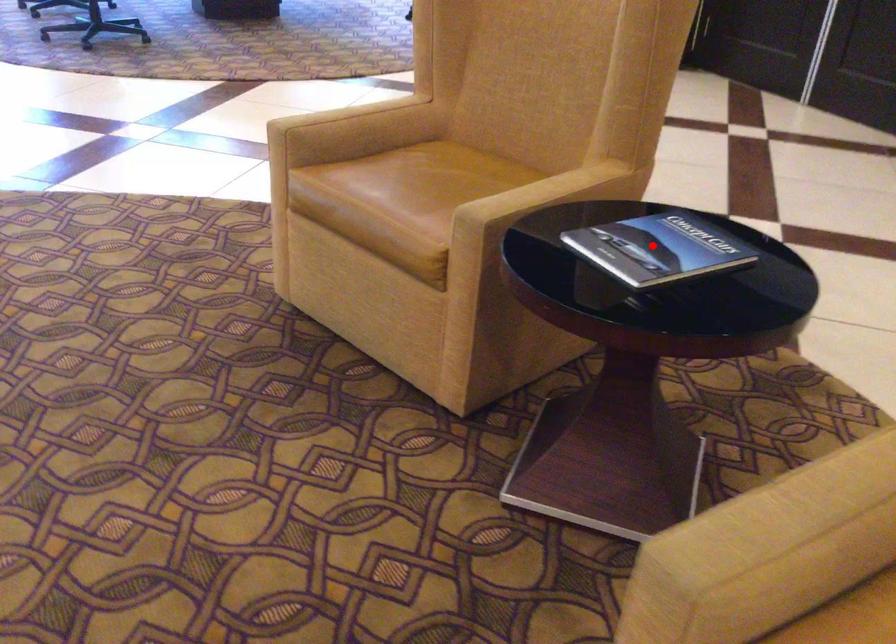
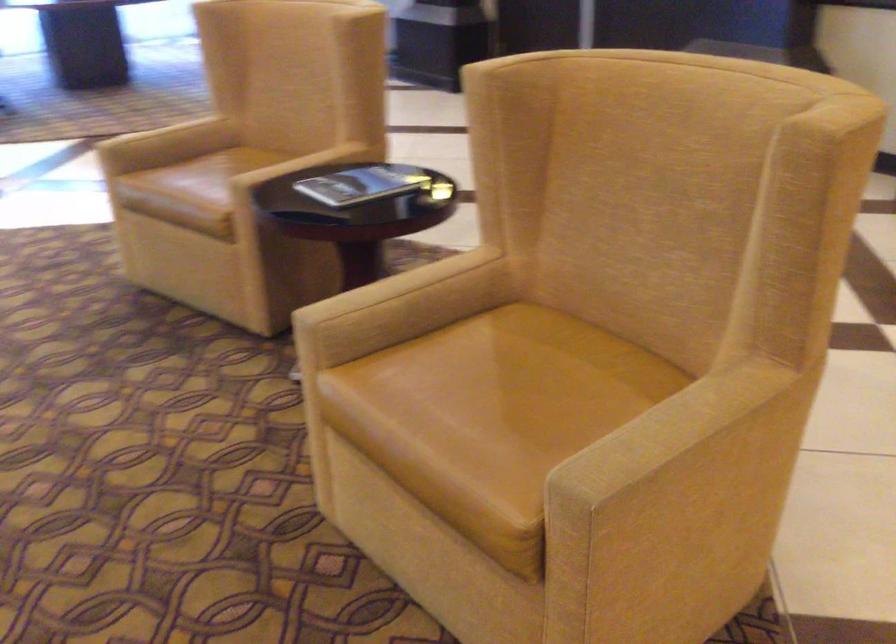
Question: I am providing you with two images of the same scene from different viewpoints. Given a red point in image1, look at the same physical point in image2. Is it:

Choices:
 (A) Closer to the viewpoint
 (B) Farther from the viewpoint

Answer: (B)